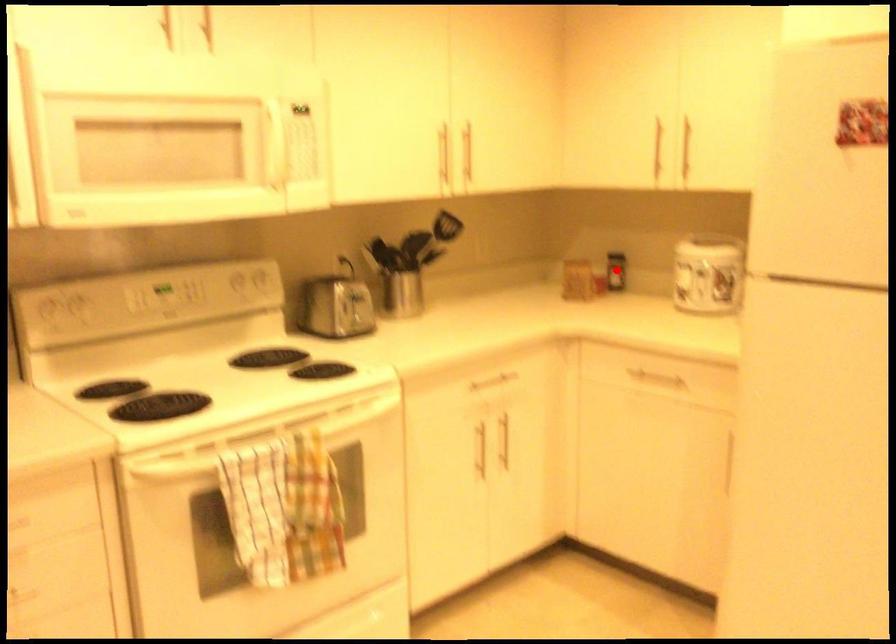
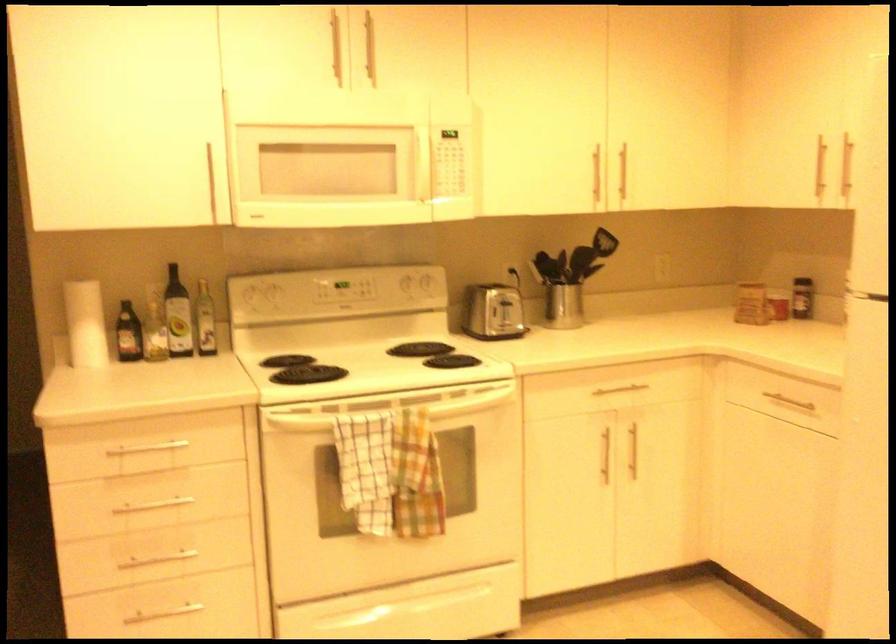
The point at the highlighted location is marked in the first image. Where is the corresponding point in the second image?

(802, 298)